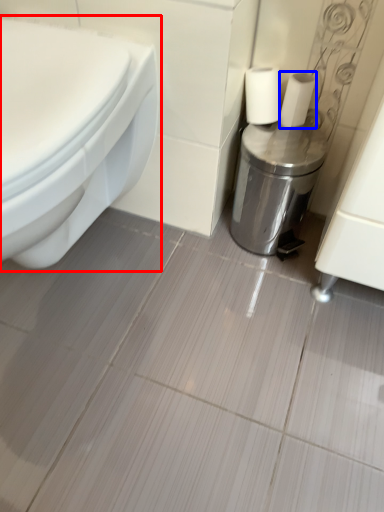
Question: Among these objects, which one is farthest to the camera, toilet (highlighted by a red box) or toilet paper (highlighted by a blue box)?

Choices:
 (A) toilet
 (B) toilet paper

Answer: (B)